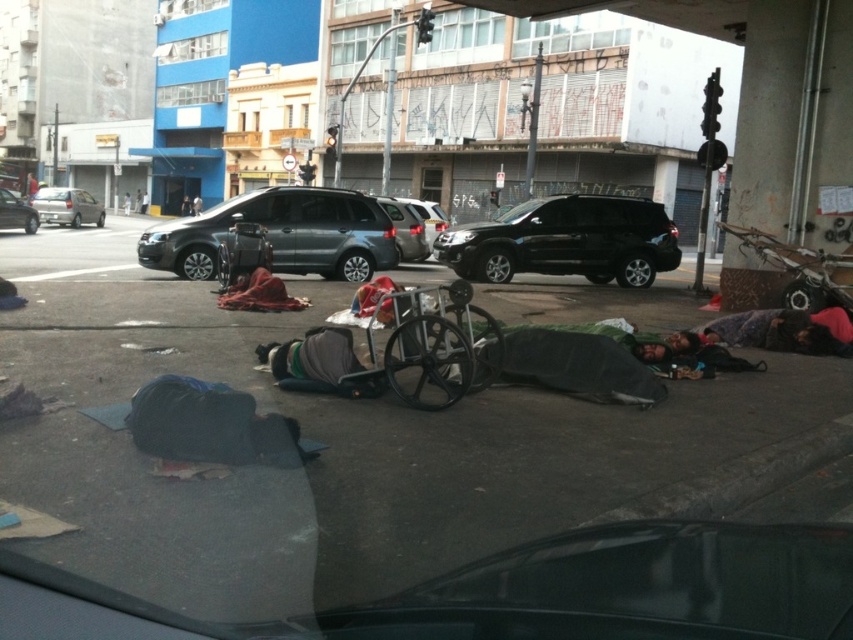
Can you confirm if matte gray suv at center is smaller than blue fabric sleeping bag at lower left?

No.

Can you confirm if matte gray suv at center is taller than blue fabric sleeping bag at lower left?

Yes, matte gray suv at center is taller than blue fabric sleeping bag at lower left.

Who is more forward, (158, 240) or (236, 424)?

Positioned in front is point (236, 424).

Identify the location of matte gray suv at center. The image size is (853, 640). (281, 234).

Which is in front, point (19, 204) or point (428, 250)?

Positioned in front is point (428, 250).

Who is more distant from viewer, (0,218) or (427,212)?

Positioned behind is point (0,218).

Between point (22, 205) and point (409, 202), which one is positioned in front?

Point (409, 202)

Locate an element on the screen. Image resolution: width=853 pixels, height=640 pixels. silver metallic sedan at center-left is located at coordinates (16, 212).

Between blue fabric sleeping bag at lower left and silver metallic sedan at center-left, which one appears on the right side from the viewer's perspective?

blue fabric sleeping bag at lower left

Image resolution: width=853 pixels, height=640 pixels. What do you see at coordinates (209, 424) in the screenshot?
I see `blue fabric sleeping bag at lower left` at bounding box center [209, 424].

Where is `blue fabric sleeping bag at lower left`? blue fabric sleeping bag at lower left is located at coordinates (209, 424).